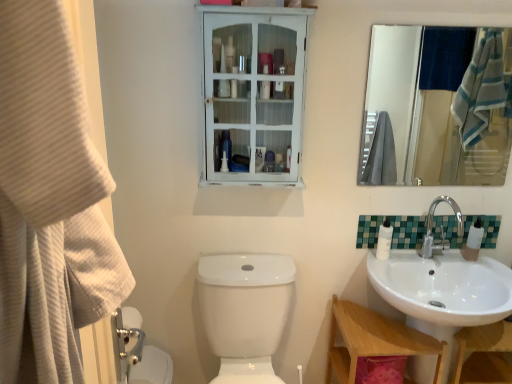
This screenshot has height=384, width=512. What are the coordinates of `empty space that is ontop of white distressed wood medicine cabinet at upper center` in the screenshot? It's located at (260, 8).